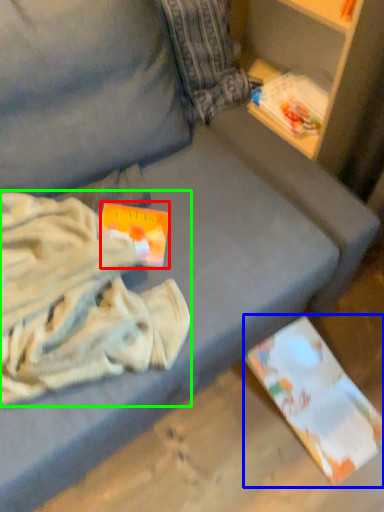
Question: Estimate the real-world distances between objects in this image. Which object is farther from paperback book (highlighted by a red box), paperback book (highlighted by a blue box) or clothing (highlighted by a green box)?

Choices:
 (A) paperback book
 (B) clothing

Answer: (A)